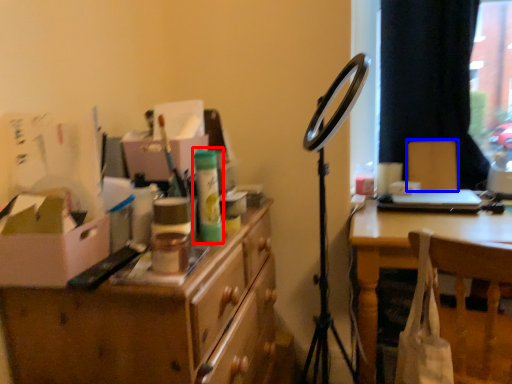
Question: Which object appears farthest to the camera in this image, toiletry (highlighted by a red box) or armchair (highlighted by a blue box)?

Choices:
 (A) toiletry
 (B) armchair

Answer: (B)